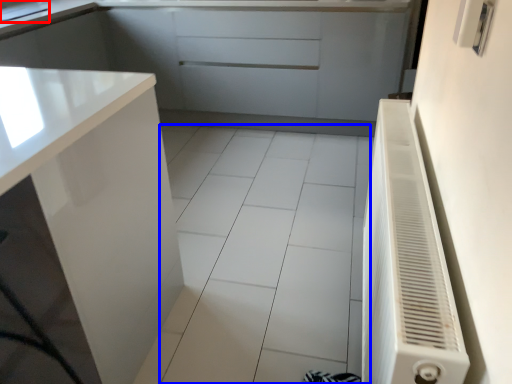
Question: Which object appears farthest to the camera in this image, sink (highlighted by a red box) or ceramic tile (highlighted by a blue box)?

Choices:
 (A) sink
 (B) ceramic tile

Answer: (A)